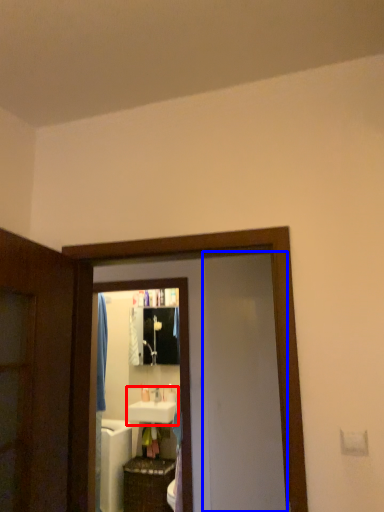
Question: Which object appears closest to the camera in this image, sink (highlighted by a red box) or screen door (highlighted by a blue box)?

Choices:
 (A) sink
 (B) screen door

Answer: (B)